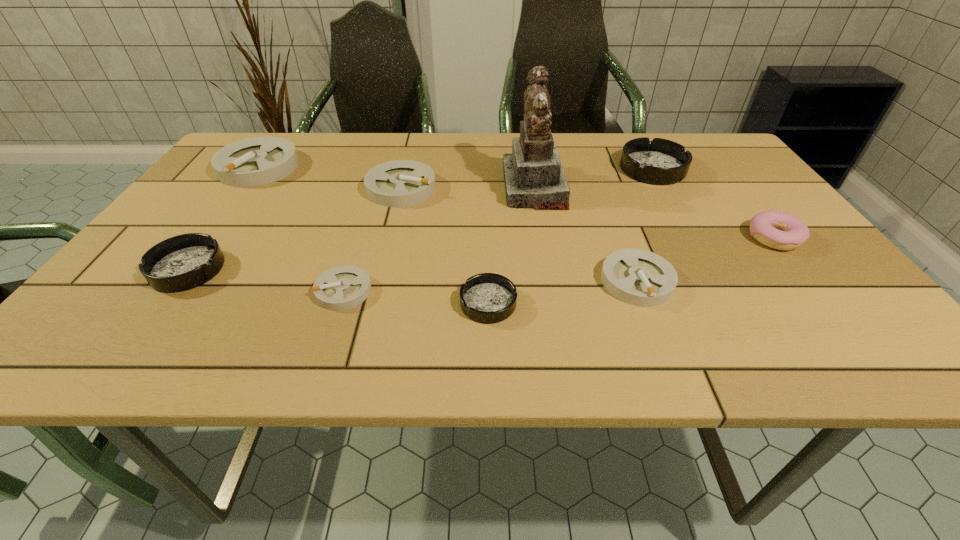
Where is `vacant area at the near edge`? Image resolution: width=960 pixels, height=540 pixels. vacant area at the near edge is located at coordinates (717, 341).

Where is `vacant area at the right edge`? Image resolution: width=960 pixels, height=540 pixels. vacant area at the right edge is located at coordinates (818, 275).

Locate an element on the screen. The width and height of the screenshot is (960, 540). vacant space at the far right corner of the desktop is located at coordinates (700, 140).

Find the location of a particular element. The image size is (960, 540). vacant area that lies between the leftmost gray ashtray and the farthest dark ashtray is located at coordinates (456, 168).

Where is `free point between the leftmost gray ashtray and the second biggest gray ashtray`? This screenshot has width=960, height=540. free point between the leftmost gray ashtray and the second biggest gray ashtray is located at coordinates (330, 178).

Locate an element on the screen. free spot between the second smallest gray ashtray and the fifth ashtray from left to right is located at coordinates (563, 292).

Where is `vacant area between the figurine and the farthest dark ashtray`? vacant area between the figurine and the farthest dark ashtray is located at coordinates 593,178.

This screenshot has height=540, width=960. I want to click on vacant area between the second biggest gray ashtray and the biggest gray ashtray, so click(x=330, y=178).

I want to click on free space between the figurine and the second smallest dark ashtray, so click(x=361, y=228).

Locate which object ranks seventh in proximity to the second smallest dark ashtray. Please provide its 2D coordinates. Your answer should be formatted as a tuple, i.e. [(x, y)], where the tuple contains the x and y coordinates of a point satisfying the conditions above.

[(658, 162)]